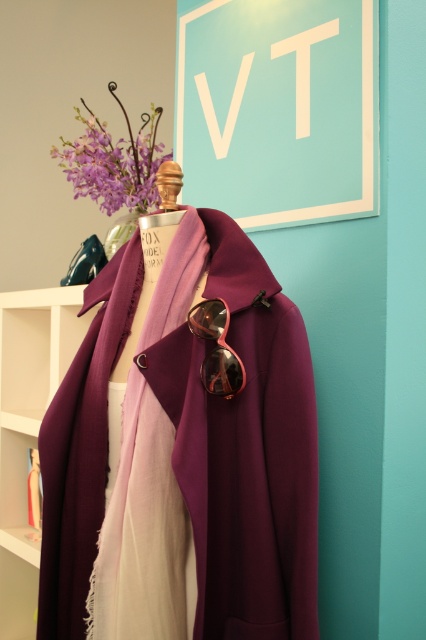
Question: Based on their relative distances, which object is nearer to the white matte bookshelf at left?

Choices:
 (A) purple matte vase at upper center
 (B) matte purple coat at center

Answer: (A)

Question: Which point is farther to the camera?

Choices:
 (A) (80, 321)
 (B) (230, 356)
 (C) (132, 493)

Answer: (A)

Question: Does purple matte vase at upper center appear over shiny metallic goggles at center?

Choices:
 (A) yes
 (B) no

Answer: (A)

Question: Is white matte bookshelf at left wider than shiny metallic goggles at center?

Choices:
 (A) no
 (B) yes

Answer: (B)

Question: Can you confirm if matte purple coat at center is thinner than shiny metallic goggles at center?

Choices:
 (A) no
 (B) yes

Answer: (A)

Question: Which object is positioned farthest from the matte purple coat at center?

Choices:
 (A) shiny metallic goggles at center
 (B) white matte bookshelf at left

Answer: (B)